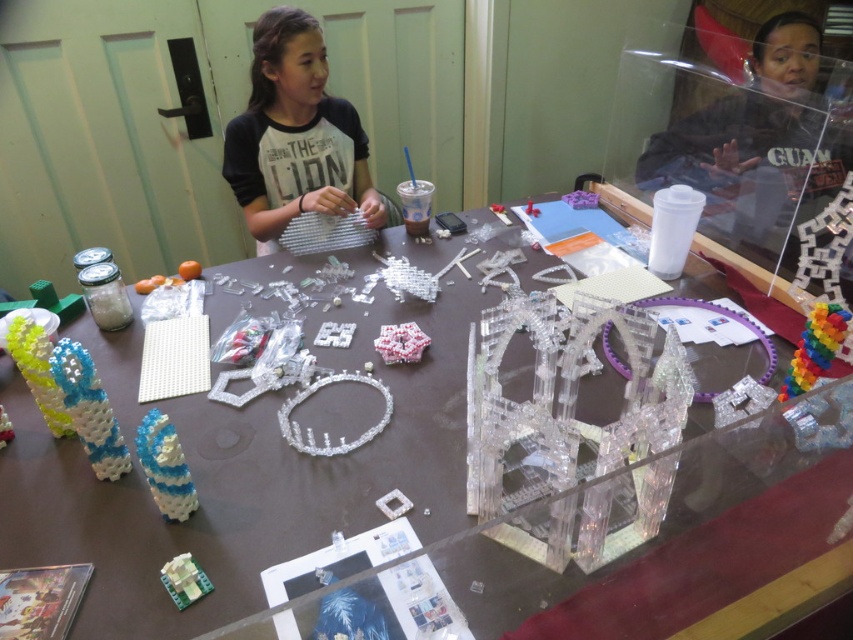
Question: Is translucent blue plastic toy at lower left in front of rainbow plastic toy at right?

Choices:
 (A) yes
 (B) no

Answer: (A)

Question: Estimate the real-world distances between objects in this image. Which object is farther from the matte black shirt at upper center?

Choices:
 (A) rainbow plastic toy at right
 (B) translucent blue plastic toy at lower left

Answer: (A)

Question: Which object is closer to the camera taking this photo?

Choices:
 (A) translucent plastic building at lower left
 (B) clear plastic table at center

Answer: (B)

Question: Estimate the real-world distances between objects in this image. Which object is farther from the matte black shirt at upper center?

Choices:
 (A) translucent blue plastic toy at lower left
 (B) clear plastic table at center
 (C) rainbow plastic toy at right

Answer: (C)

Question: Does matte black shirt at upper center appear on the right side of translucent plastic cube at center?

Choices:
 (A) yes
 (B) no

Answer: (B)

Question: Can you confirm if translucent blue plastic toy at lower left is positioned to the right of translucent plastic building at lower left?

Choices:
 (A) yes
 (B) no

Answer: (B)